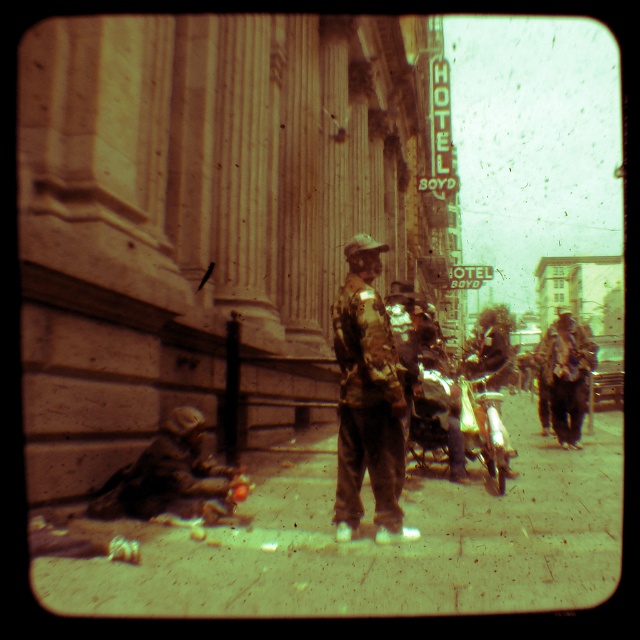
You are a photographer trying to capture a photo of the shiny chrome motorcycle at center. To ensure the motorcycle is the main focus, you want to avoid including the smooth concrete sidewalk at lower left in the frame. Based on their positions, can you position yourself in a way to exclude the sidewalk?

The smooth concrete sidewalk at lower left is on the left side of the shiny chrome motorcycle at center. To exclude the sidewalk, position yourself to the right of the motorcycle so the sidewalk is out of frame.

In the scene shown: You are a delivery person who needs to place a small package on the smooth concrete sidewalk at lower left. However, there is a shiny chrome motorcycle at center blocking the path. Can you place the package on the sidewalk without moving the motorcycle?

The smooth concrete sidewalk at lower left is not as tall as the shiny chrome motorcycle at center, so the motorcycle is taller than the sidewalk. Since the motorcycle is blocking the path, you can still place the package on the sidewalk as long as there is enough space around the motorcycle to reach it. However, you need to ensure that the motorcycle isn